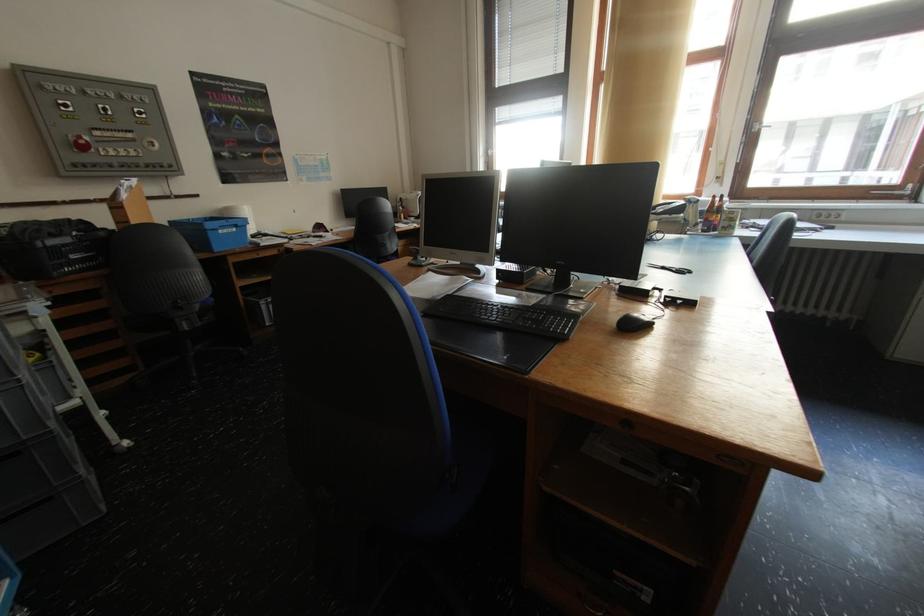
The height and width of the screenshot is (616, 924). What do you see at coordinates (213, 233) in the screenshot?
I see `a blue plastic bin` at bounding box center [213, 233].